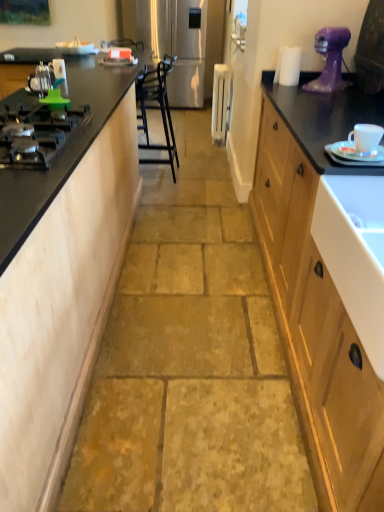
Locate an element on the screen. The height and width of the screenshot is (512, 384). stainless steel refrigerator at center, which is the first appliance in top-to-bottom order is located at coordinates (180, 41).

Find the location of `metallic silver kettle at left, marked as the 1th appliance in a left-to-right arrangement`. metallic silver kettle at left, marked as the 1th appliance in a left-to-right arrangement is located at coordinates (41, 79).

From a real-world perspective, who is located higher, white glossy juicer at upper center or stainless steel refrigerator at center, acting as the fourth appliance starting from the front?

From a 3D spatial view, white glossy juicer at upper center is above.

Is white glossy juicer at upper center far away from stainless steel refrigerator at center, which is the second appliance from left to right?

Yes, white glossy juicer at upper center is far from stainless steel refrigerator at center, which is the second appliance from left to right.

Looking at the image, does white glossy juicer at upper center seem bigger or smaller compared to stainless steel refrigerator at center, which is the 1th appliance in back-to-front order?

Considering their sizes, white glossy juicer at upper center takes up less space than stainless steel refrigerator at center, which is the 1th appliance in back-to-front order.

Considering the sizes of objects white glossy juicer at upper center and stainless steel refrigerator at center, which is the second appliance from left to right, in the image provided, who is wider, white glossy juicer at upper center or stainless steel refrigerator at center, which is the second appliance from left to right,?

stainless steel refrigerator at center, which is the second appliance from left to right.

Is white plastic radiator at center, the 2th appliance when ordered from back to front, wider or thinner than white ceramic cup at right, the first appliance when ordered from bottom to top?

Considering their sizes, white plastic radiator at center, the 2th appliance when ordered from back to front, looks broader than white ceramic cup at right, the first appliance when ordered from bottom to top.

Considering their positions, is white plastic radiator at center, which is counted as the 3th appliance, starting from the left, located in front of or behind white ceramic cup at right, the fourth appliance in the back-to-front sequence?

Visually, white plastic radiator at center, which is counted as the 3th appliance, starting from the left, is located behind white ceramic cup at right, the fourth appliance in the back-to-front sequence.

Is point (215, 89) farther from viewer compared to point (365, 130)?

Yes, point (215, 89) is behind point (365, 130).

Consider the image. In terms of height, does white plastic radiator at center, the 2th appliance when ordered from back to front, look taller or shorter compared to white ceramic cup at right, arranged as the first appliance when viewed from the front?

Considering their sizes, white plastic radiator at center, the 2th appliance when ordered from back to front, has more height than white ceramic cup at right, arranged as the first appliance when viewed from the front.

This screenshot has height=512, width=384. I want to click on appliance that is the 1st object above the matte wood cabinet at left (from a real-world perspective), so click(x=180, y=41).

Considering the sizes of objects matte wood cabinet at left and stainless steel refrigerator at center, which is the second appliance from left to right, in the image provided, who is smaller, matte wood cabinet at left or stainless steel refrigerator at center, which is the second appliance from left to right,?

With smaller size is stainless steel refrigerator at center, which is the second appliance from left to right.

Measure the distance between white glossy saucer at right and stainless steel refrigerator at center, which is the first appliance in top-to-bottom order.

They are 4.86 meters apart.

Which of these two, white glossy saucer at right or stainless steel refrigerator at center, which is the second appliance from left to right, is smaller?

white glossy saucer at right is smaller.

Which object is thinner, white glossy saucer at right or stainless steel refrigerator at center, which is the first appliance in top-to-bottom order?

white glossy saucer at right.

Looking at this image, is metallic silver kettle at left, which ranks as the fourth appliance in right-to-left order, positioned beyond the bounds of white glossy sink at right?

Yes.

Can you confirm if metallic silver kettle at left, which is counted as the second appliance, starting from the bottom, is taller than white glossy sink at right?

No.

Is white glossy sink at right at the back of metallic silver kettle at left, which is counted as the second appliance, starting from the bottom?

No, metallic silver kettle at left, which is counted as the second appliance, starting from the bottom, is not facing the opposite direction of white glossy sink at right.

In the scene shown: Considering their positions, is metallic silver kettle at left, positioned as the second appliance in front-to-back order, located in front of or behind white glossy sink at right?

metallic silver kettle at left, positioned as the second appliance in front-to-back order, is positioned farther from the viewer than white glossy sink at right.

This screenshot has width=384, height=512. What are the coordinates of `kitchen appliance above the white glossy sink at right (from a real-world perspective)` in the screenshot? It's located at (75, 47).

From the image's perspective, is white glossy sink at right located above or below white glossy juicer at upper center?

Based on their image positions, white glossy sink at right is located beneath white glossy juicer at upper center.

Is white glossy sink at right oriented towards white glossy juicer at upper center?

No, white glossy sink at right is not facing towards white glossy juicer at upper center.

Is point (379, 255) positioned behind point (56, 46)?

No, (379, 255) is closer to viewer.

From the image's perspective, is metallic silver kettle at left, positioned as the second appliance in front-to-back order, located above purple plastic mixer at upper right?

No.

Is metallic silver kettle at left, which is counted as the second appliance, starting from the bottom, at the left side of purple plastic mixer at upper right?

Yes.

Considering the sizes of metallic silver kettle at left, the third appliance when ordered from back to front, and purple plastic mixer at upper right in the image, is metallic silver kettle at left, the third appliance when ordered from back to front, wider or thinner than purple plastic mixer at upper right?

In the image, metallic silver kettle at left, the third appliance when ordered from back to front, appears to be more narrow than purple plastic mixer at upper right.

Identify the location of the 1st appliance in front of the purple plastic mixer at upper right. The width and height of the screenshot is (384, 512). (41, 79).

At what (x,y) coordinates should I click in order to perform the action: click on kitchen appliance that appears in front of the stainless steel refrigerator at center, which is the second appliance from left to right. Please return your answer as a coordinate pair (x, y). The width and height of the screenshot is (384, 512). Looking at the image, I should click on (75, 47).

In order to click on the 2nd appliance above the white ceramic cup at right, the first appliance when ordered from bottom to top (from the image's perspective) in this screenshot , I will do `click(220, 103)`.

Estimate the real-world distances between objects in this image. Which object is further from purple plastic mixer at upper right, metallic silver kettle at left, which is counted as the second appliance, starting from the bottom, or matte wood cabinet at left?

metallic silver kettle at left, which is counted as the second appliance, starting from the bottom, is further to purple plastic mixer at upper right.

Looking at the image, which one is located further to black matte gas stove at left, matte wood cabinet at left or white ceramic cup at right, arranged as the first appliance when viewed from the front?

white ceramic cup at right, arranged as the first appliance when viewed from the front, is further to black matte gas stove at left.

Estimate the real-world distances between objects in this image. Which object is further from black metal chair at center, white glossy sink at right or purple plastic mixer at upper right?

white glossy sink at right.

Which object lies further to the anchor point white ceramic cup at right, the first appliance when ordered from bottom to top, white glossy sink at right or metallic silver kettle at left, which ranks as the fourth appliance in right-to-left order?

Based on the image, metallic silver kettle at left, which ranks as the fourth appliance in right-to-left order, appears to be further to white ceramic cup at right, the first appliance when ordered from bottom to top.

Considering their positions, is white plastic radiator at center, which appears as the third appliance when ordered from the bottom, positioned further to white glossy saucer at right than white ceramic cup at right, the fourth appliance in the back-to-front sequence?

The object further to white glossy saucer at right is white plastic radiator at center, which appears as the third appliance when ordered from the bottom.

Considering their positions, is black matte gas stove at left positioned closer to black metal chair at center than metallic silver kettle at left, which ranks as the fourth appliance in right-to-left order?

metallic silver kettle at left, which ranks as the fourth appliance in right-to-left order, lies closer to black metal chair at center than the other object.

Looking at the image, which one is located closer to white plastic radiator at center, the 2th appliance when ordered from back to front, stainless steel refrigerator at center, arranged as the 4th appliance when ordered from the bottom, or white glossy saucer at right?

stainless steel refrigerator at center, arranged as the 4th appliance when ordered from the bottom, lies closer to white plastic radiator at center, the 2th appliance when ordered from back to front, than the other object.

Looking at the image, which one is located closer to white glossy sink at right, stainless steel refrigerator at center, arranged as the 4th appliance when ordered from the bottom, or black metal chair at center?

black metal chair at center is closer to white glossy sink at right.

Locate an element on the screen. The height and width of the screenshot is (512, 384). saucer between white glossy sink at right and purple plastic mixer at upper right in the front-back direction is located at coordinates (354, 152).

Identify the location of sink between matte wood cabinet at left and black metal chair at center in the front-back direction. (355, 252).

I want to click on appliance located between white glossy saucer at right and black metal chair at center in the depth direction, so click(x=41, y=79).

Locate an element on the screen. home appliance between white ceramic cup at right, which is counted as the 4th appliance, starting from the left, and black metal chair at center, along the z-axis is located at coordinates (330, 60).